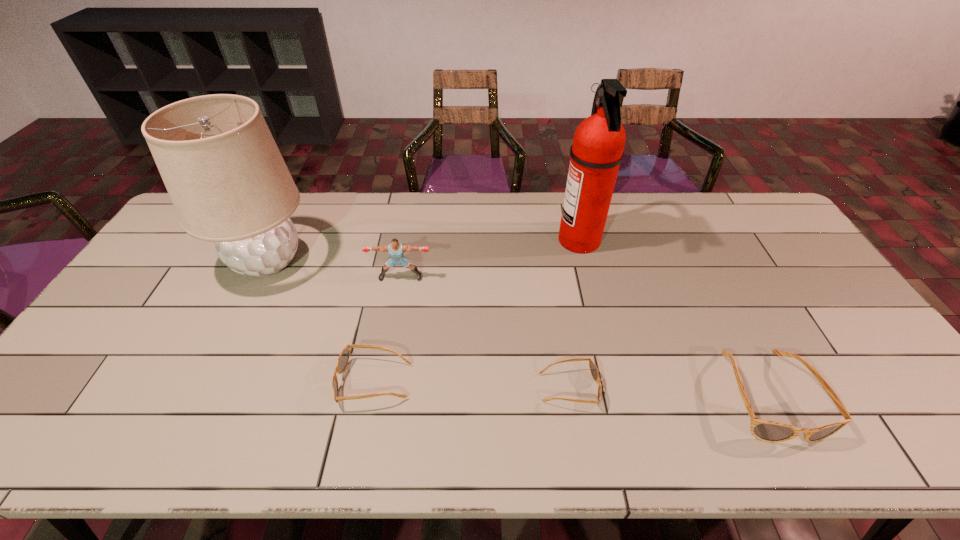
You are a GUI agent. You are given a task and a screenshot of the screen. Output one action in this format:
    pyautogui.click(x=<x>, y=<y>)
    Task: Click on the vacant space located 0.330m on the front-facing side of the fifth tallest object
    This screenshot has width=960, height=540.
    Given the screenshot: What is the action you would take?
    click(205, 382)

At what (x,y) coordinates should I click in order to perform the action: click on vacant region located 0.330m on the front-facing side of the fifth tallest object. Please return your answer as a coordinate pair (x, y). The width and height of the screenshot is (960, 540). Looking at the image, I should click on (205, 382).

This screenshot has height=540, width=960. Identify the location of free space located on the front-facing side of the shortest object. (721, 388).

I want to click on vacant space located on the front-facing side of the puncher, so click(390, 338).

Identify the location of vacant area situated on the side of the fire extinguisher near the handle. The height and width of the screenshot is (540, 960). (469, 240).

Where is `vacant space positioned 0.050m on the side of the fire extinguisher near the handle`? The height and width of the screenshot is (540, 960). vacant space positioned 0.050m on the side of the fire extinguisher near the handle is located at coordinates (542, 240).

At what (x,y) coordinates should I click in order to perform the action: click on vacant point located 0.100m on the side of the fire extinguisher near the handle. Please return your answer as a coordinate pair (x, y). Looking at the image, I should click on (527, 240).

Locate an element on the screen. This screenshot has width=960, height=540. vacant space positioned 0.160m on the right of the leftmost object is located at coordinates (368, 261).

In order to click on fire extinguisher that is at the far edge in this screenshot , I will do `click(596, 153)`.

You are a GUI agent. You are given a task and a screenshot of the screen. Output one action in this format:
    pyautogui.click(x=<x>, y=<y>)
    Task: Click on the lampshade that is at the far edge
    The image size is (960, 540).
    Given the screenshot: What is the action you would take?
    pyautogui.click(x=228, y=182)